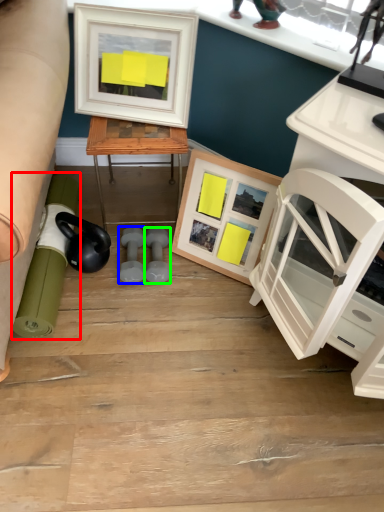
Question: Which is farther away from rolling pin (highlighted by a red box)? dumbbell (highlighted by a blue box) or dumbbell (highlighted by a green box)?

Choices:
 (A) dumbbell
 (B) dumbbell

Answer: (B)